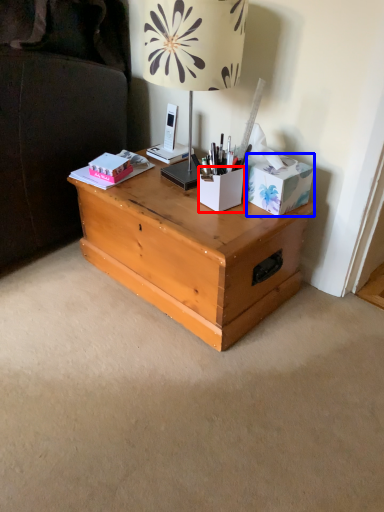
Question: Which object is closer to the camera taking this photo, cardboard box (highlighted by a red box) or cardboard box (highlighted by a blue box)?

Choices:
 (A) cardboard box
 (B) cardboard box

Answer: (B)